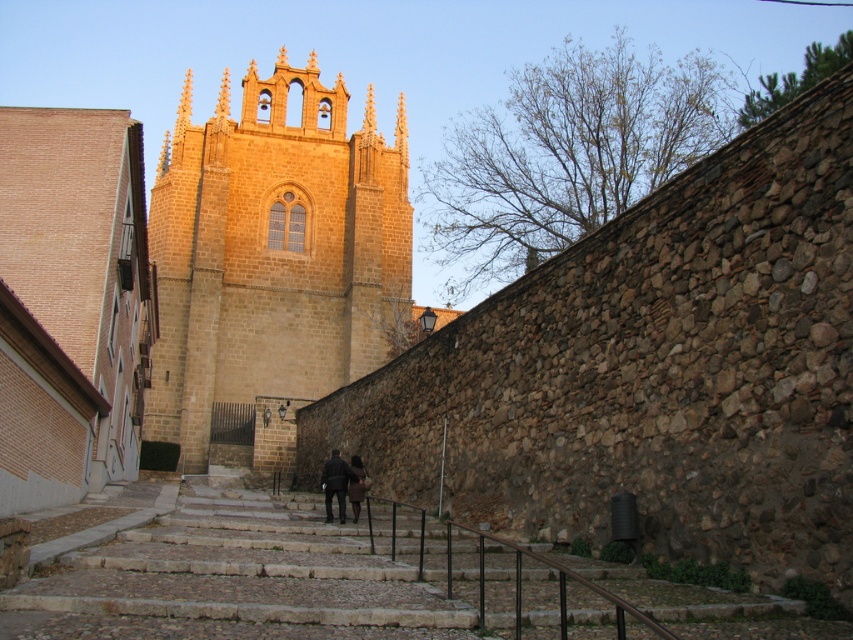
Question: Which point appears farthest from the camera in this image?

Choices:
 (A) (329, 336)
 (B) (334, 465)
 (C) (352, 493)

Answer: (A)

Question: Does dark brown leather jacket at center appear under dark brown leather coat at center?

Choices:
 (A) no
 (B) yes

Answer: (B)

Question: Among these points, which one is nearest to the camera?

Choices:
 (A) (354, 369)
 (B) (339, 476)

Answer: (B)

Question: Does dark brown leather jacket at center have a smaller size compared to dark brown leather coat at center?

Choices:
 (A) no
 (B) yes

Answer: (A)

Question: Is golden stone tower at center bigger than dark brown leather coat at center?

Choices:
 (A) no
 (B) yes

Answer: (B)

Question: Considering the real-world distances, which object is closest to the dark brown leather coat at center?

Choices:
 (A) dark brown leather jacket at center
 (B) golden stone tower at center

Answer: (A)